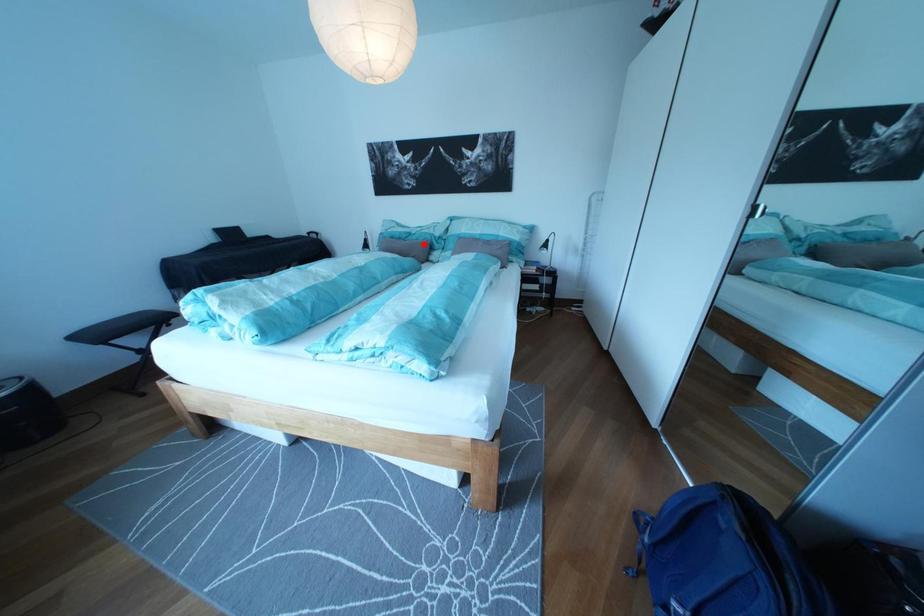
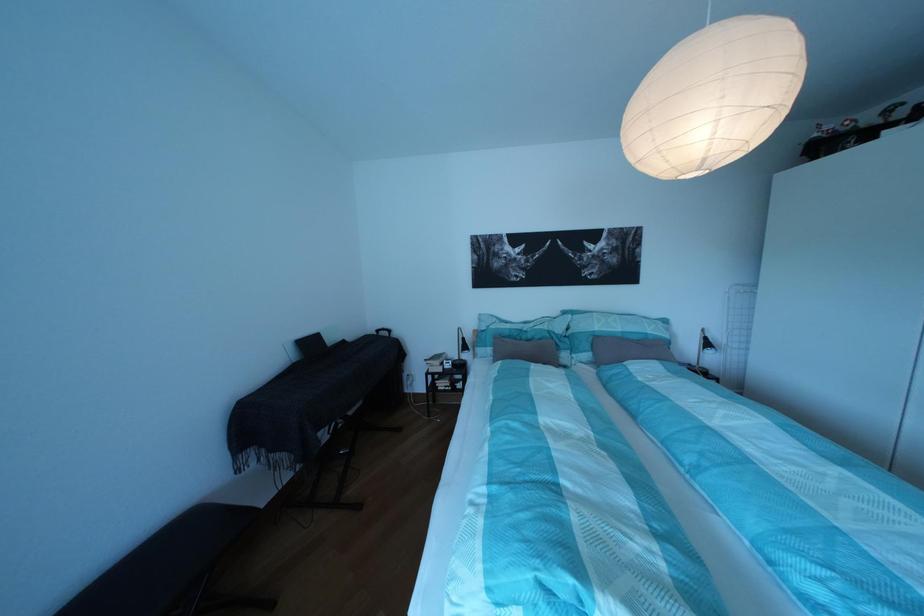
Question: I am providing you with two images of the same scene from different viewpoints. Given a red point in image1, look at the same physical point in image2. Is it:

Choices:
 (A) Closer to the viewpoint
 (B) Farther from the viewpoint

Answer: (B)